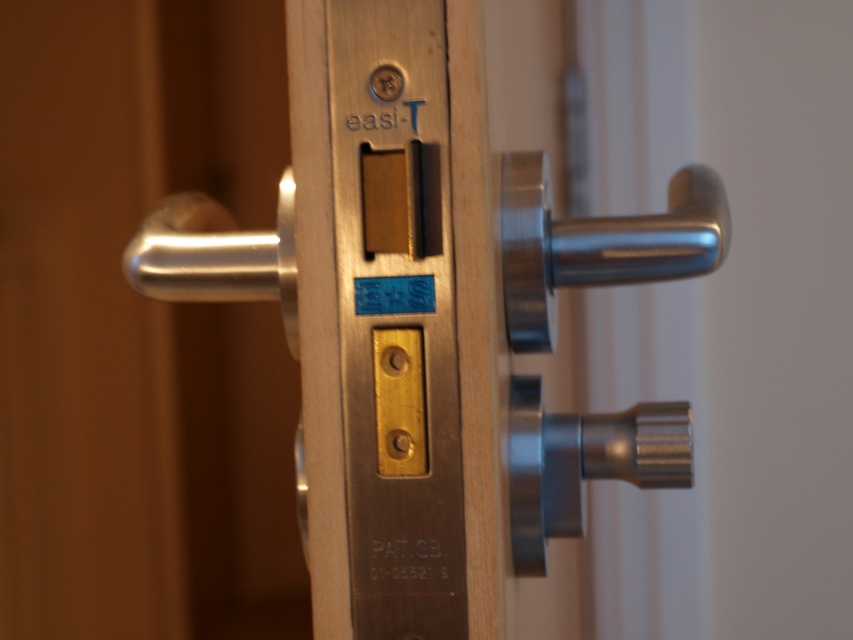
In the scene shown: Can you confirm if satin nickel handle at center right is smaller than satin metal knob at lower right?

Actually, satin nickel handle at center right might be larger than satin metal knob at lower right.

Who is positioned more to the left, satin nickel handle at center right or satin metal knob at lower right?

Positioned to the left is satin metal knob at lower right.

Measure the distance between satin nickel handle at center right and camera.

satin nickel handle at center right and camera are 24.04 inches apart from each other.

The height and width of the screenshot is (640, 853). In order to click on satin nickel handle at center right in this screenshot , I will do `click(596, 243)`.

Can you confirm if satin nickel handle at center right is positioned above satin silver handle at left?

Yes.

Between satin nickel handle at center right and satin silver handle at left, which one is positioned lower?

Positioned lower is satin silver handle at left.

Does point (537, 244) lie in front of point (293, 308)?

That is True.

Locate an element on the screen. satin nickel handle at center right is located at coordinates (596, 243).

Which is in front, point (561, 508) or point (282, 298)?

Point (282, 298)

Where is `satin metal knob at lower right`? satin metal knob at lower right is located at coordinates (582, 464).